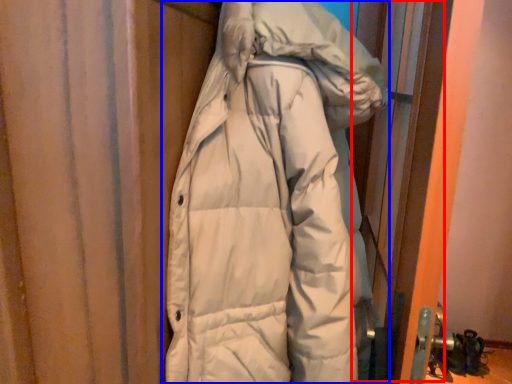
Question: Which point is closer to the camera, screen door (highlighted by a red box) or jacket (highlighted by a blue box)?

Choices:
 (A) screen door
 (B) jacket

Answer: (B)